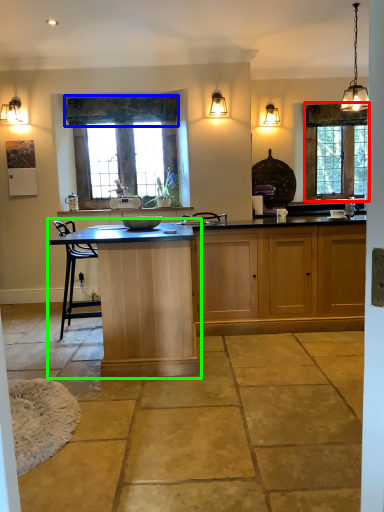
Question: Estimate the real-world distances between objects in this image. Which object is farther from window (highlighted by a red box), curtain (highlighted by a blue box) or table (highlighted by a green box)?

Choices:
 (A) curtain
 (B) table

Answer: (B)